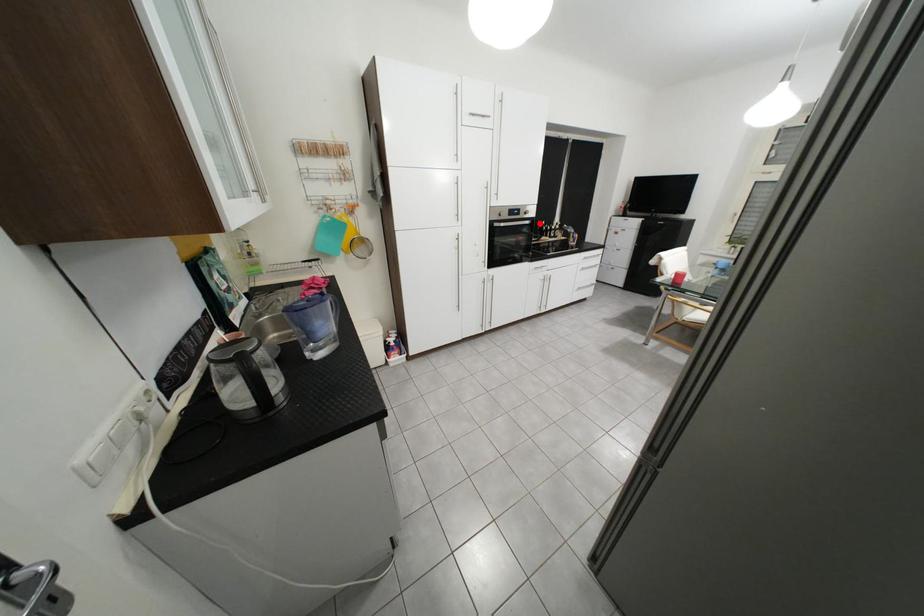
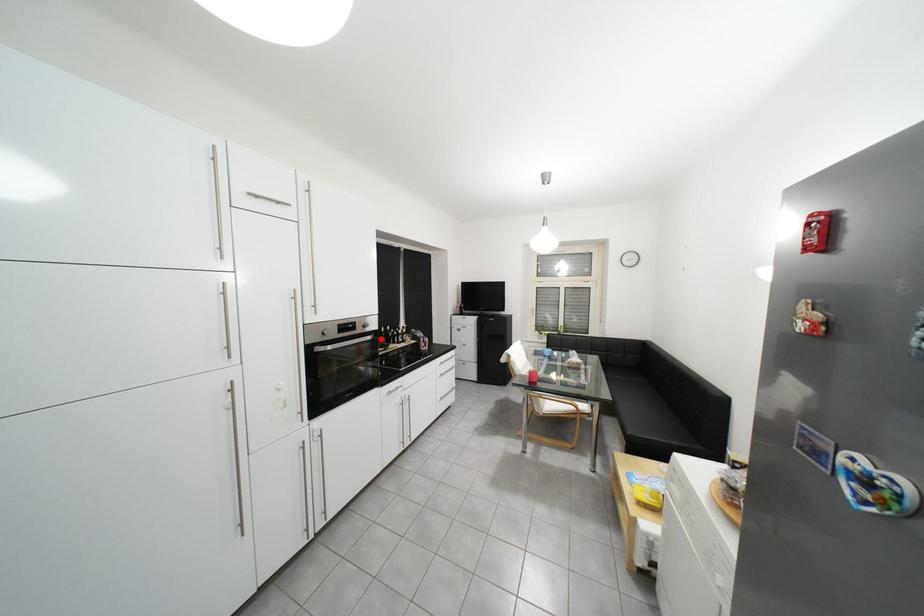
I am providing you with two images of the same scene from different viewpoints. A red point is marked on the first image and another point is marked on the second image. Do the highlighted points in image1 and image2 indicate the same real-world spot?

Yes